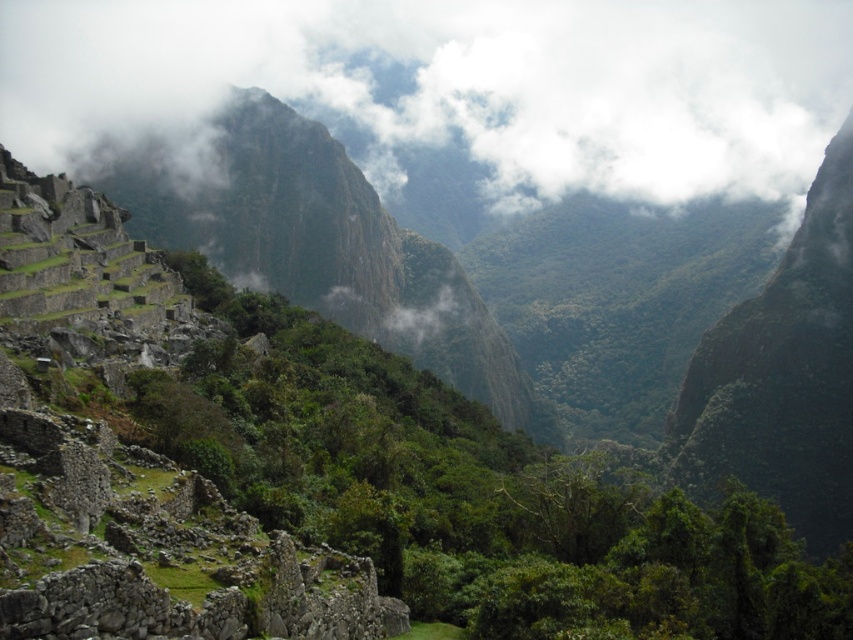
Question: Which object appears farthest from the camera in this image?

Choices:
 (A) green leafy vegetation at center
 (B) white fluffy cloud at upper center

Answer: (B)

Question: Which of the following is the closest to the observer?

Choices:
 (A) white fluffy cloud at upper center
 (B) green leafy vegetation at center

Answer: (B)

Question: Is white fluffy cloud at upper center smaller than green leafy vegetation at center?

Choices:
 (A) yes
 (B) no

Answer: (B)

Question: Does white fluffy cloud at upper center come in front of green leafy vegetation at center?

Choices:
 (A) yes
 (B) no

Answer: (B)

Question: Can you confirm if white fluffy cloud at upper center is positioned to the left of green leafy vegetation at center?

Choices:
 (A) no
 (B) yes

Answer: (A)